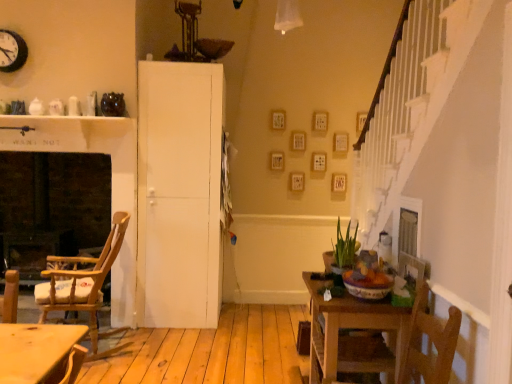
Question: Considering the relative positions of wooden table at lower right and wooden rocking chair at left in the image provided, is wooden table at lower right to the left or to the right of wooden rocking chair at left?

Choices:
 (A) left
 (B) right

Answer: (B)

Question: Is wooden table at lower right bigger or smaller than wooden rocking chair at left?

Choices:
 (A) big
 (B) small

Answer: (B)

Question: Based on their relative distances, which object is farther from the white matte door at center?

Choices:
 (A) wooden rocking chair at left
 (B) green matte plant at center
 (C) brick fireplace at left
 (D) wooden table at lower right
 (E) black metal clock at upper left

Answer: (D)

Question: Based on their relative distances, which object is nearer to the wooden table at lower right?

Choices:
 (A) black metal clock at upper left
 (B) brick fireplace at left
 (C) white matte door at center
 (D) green matte plant at center
 (E) wooden rocking chair at left

Answer: (D)